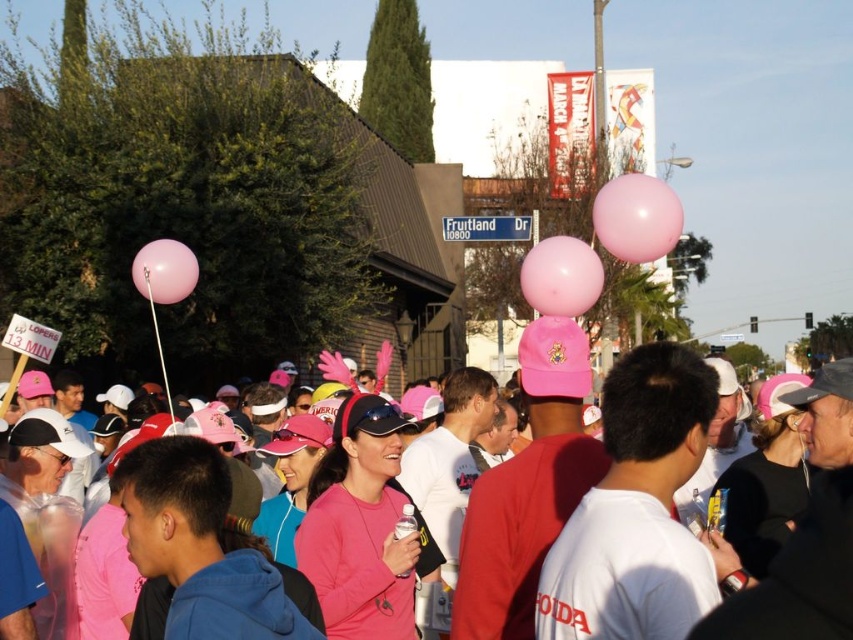
Measure the distance between pink rubber balloon at center and camera.

The distance of pink rubber balloon at center from camera is 40.64 meters.

Who is more forward, (575,252) or (167,262)?

Point (575,252) is more forward.

Who is more distant from viewer, (579, 278) or (171, 275)?

The point (171, 275) is more distant.

At what (x,y) coordinates should I click in order to perform the action: click on pink rubber balloon at center. Please return your answer as a coordinate pair (x, y). Looking at the image, I should click on (561, 276).

Which of these two, pink rubber balloon at upper right or pink rubber balloon at upper left, stands shorter?

Standing shorter between the two is pink rubber balloon at upper left.

Can you confirm if pink rubber balloon at upper right is taller than pink rubber balloon at upper left?

Yes, pink rubber balloon at upper right is taller than pink rubber balloon at upper left.

Does point (604, 198) come closer to viewer compared to point (160, 260)?

No, (604, 198) is behind (160, 260).

I want to click on pink rubber balloon at upper right, so click(636, 218).

Can you confirm if pink matte balloon at center is shorter than pink rubber balloon at center?

No.

Looking at this image, is pink matte balloon at center to the left of pink rubber balloon at center from the viewer's perspective?

Indeed, pink matte balloon at center is positioned on the left side of pink rubber balloon at center.

Is point (621, 477) farther from camera compared to point (532, 256)?

No, it is in front of (532, 256).

You are a GUI agent. You are given a task and a screenshot of the screen. Output one action in this format:
    pyautogui.click(x=<x>, y=<y>)
    Task: Click on the pink matte balloon at center
    Image resolution: width=853 pixels, height=640 pixels.
    Given the screenshot: What is the action you would take?
    pyautogui.click(x=805, y=536)